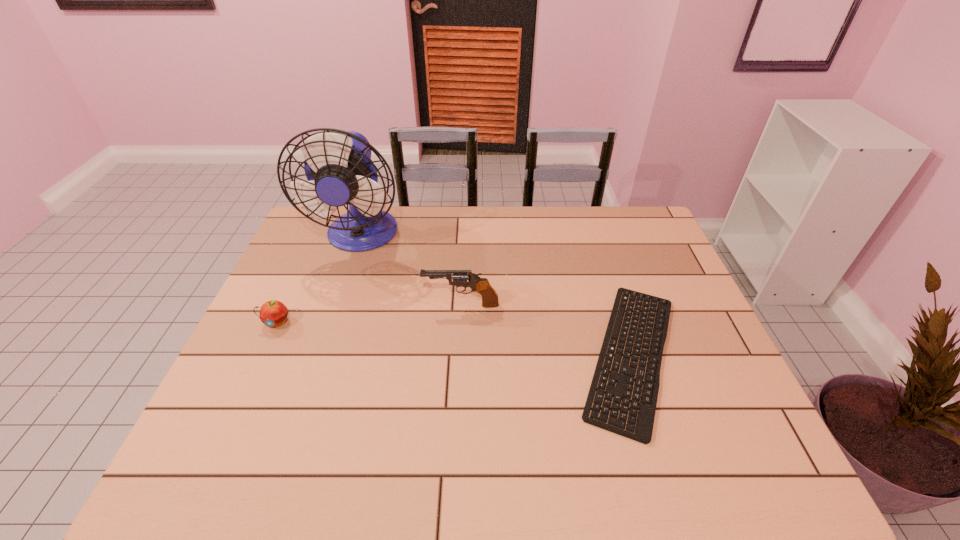
Find the location of `the farthest object`. the farthest object is located at coordinates (338, 166).

Identify the location of fan. The image size is (960, 540). (338, 166).

Locate an element on the screen. The width and height of the screenshot is (960, 540). the second object from right to left is located at coordinates (482, 286).

Identify the location of gun. tap(482, 286).

Where is `apple`? This screenshot has height=540, width=960. apple is located at coordinates (273, 313).

Where is `computer keyboard`? This screenshot has height=540, width=960. computer keyboard is located at coordinates (644, 427).

Where is `the shortest object`? The height and width of the screenshot is (540, 960). the shortest object is located at coordinates (644, 427).

The height and width of the screenshot is (540, 960). Identify the location of free space located 0.290m in front of the tallest object where the airflow is directed. (327, 337).

Locate an element on the screen. The width and height of the screenshot is (960, 540). vacant area situated along the barrel of the second object from right to left is located at coordinates (304, 305).

You are a GUI agent. You are given a task and a screenshot of the screen. Output one action in this format:
    pyautogui.click(x=<x>, y=<y>)
    Task: Click on the vacant space located along the barrel of the second object from right to left
    The height and width of the screenshot is (540, 960).
    Given the screenshot: What is the action you would take?
    pyautogui.click(x=372, y=305)